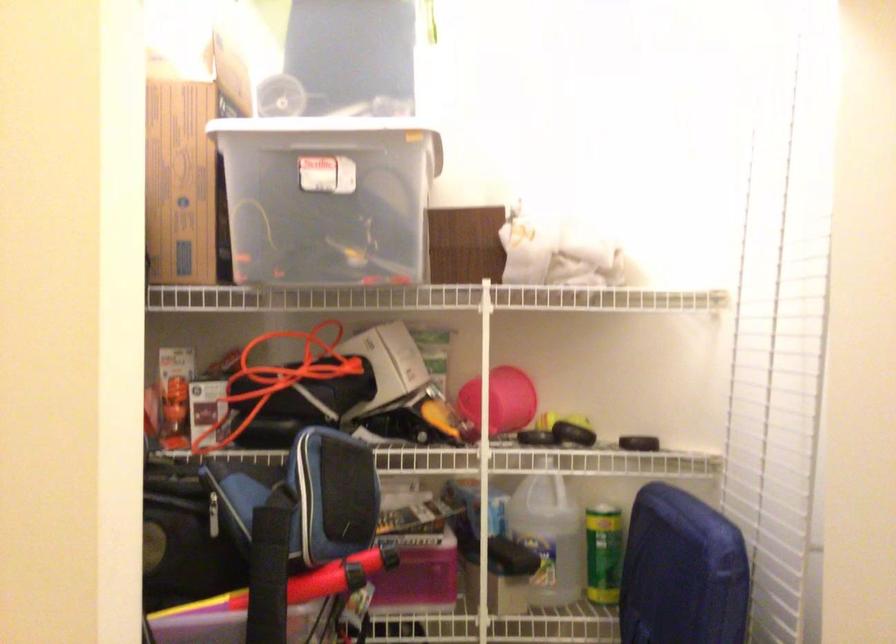
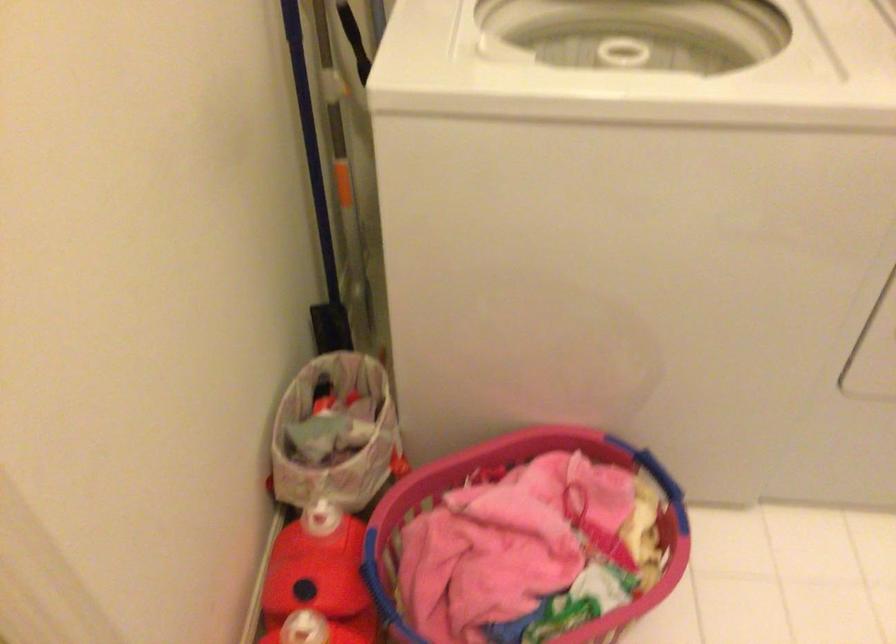
The images are taken continuously from a first-person perspective. In which direction is your viewpoint rotating?

The camera's rotation is toward left-down.